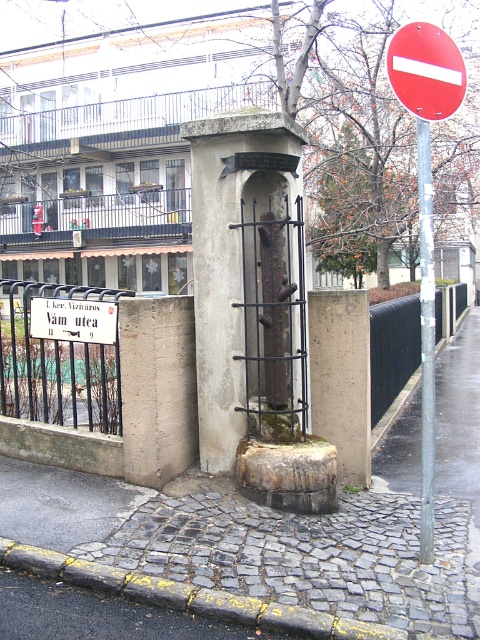
Can you confirm if cobblestone pavement at center is positioned below silver metallic pole at right?

Correct, cobblestone pavement at center is located below silver metallic pole at right.

Is cobblestone pavement at center thinner than silver metallic pole at right?

In fact, cobblestone pavement at center might be wider than silver metallic pole at right.

Is point (456, 433) closer to camera compared to point (425, 490)?

No, it is behind (425, 490).

At what (x,y) coordinates should I click in order to perform the action: click on cobblestone pavement at center. Please return your answer as a coordinate pair (x, y). This screenshot has width=480, height=640. Looking at the image, I should click on (289, 522).

Who is positioned more to the left, concrete textured pillar at center or white paper sign at upper center?

Positioned to the left is white paper sign at upper center.

Between concrete textured pillar at center and white paper sign at upper center, which one has more height?

Standing taller between the two is concrete textured pillar at center.

Between point (248, 216) and point (75, 321), which one is positioned behind?

The point (75, 321) is more distant.

The image size is (480, 640). Identify the location of concrete textured pillar at center. (231, 257).

Who is positioned more to the right, red metallic circle at upper right or white paper sign at upper center?

Positioned to the right is red metallic circle at upper right.

Consider the image. Does red metallic circle at upper right appear under white paper sign at upper center?

No.

The image size is (480, 640). Describe the element at coordinates (425, 204) in the screenshot. I see `red metallic circle at upper right` at that location.

This screenshot has height=640, width=480. I want to click on red metallic circle at upper right, so click(425, 204).